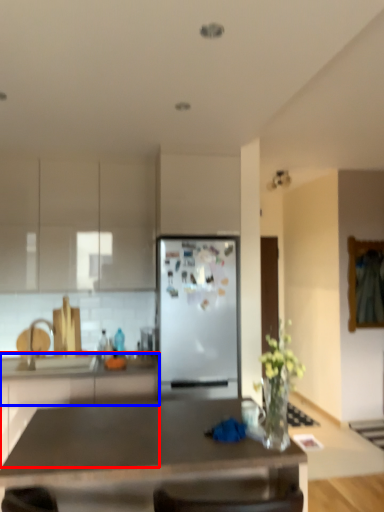
Question: Which object appears farthest to the camera in this image, cabinetry (highlighted by a red box) or counter top (highlighted by a blue box)?

Choices:
 (A) cabinetry
 (B) counter top

Answer: (B)